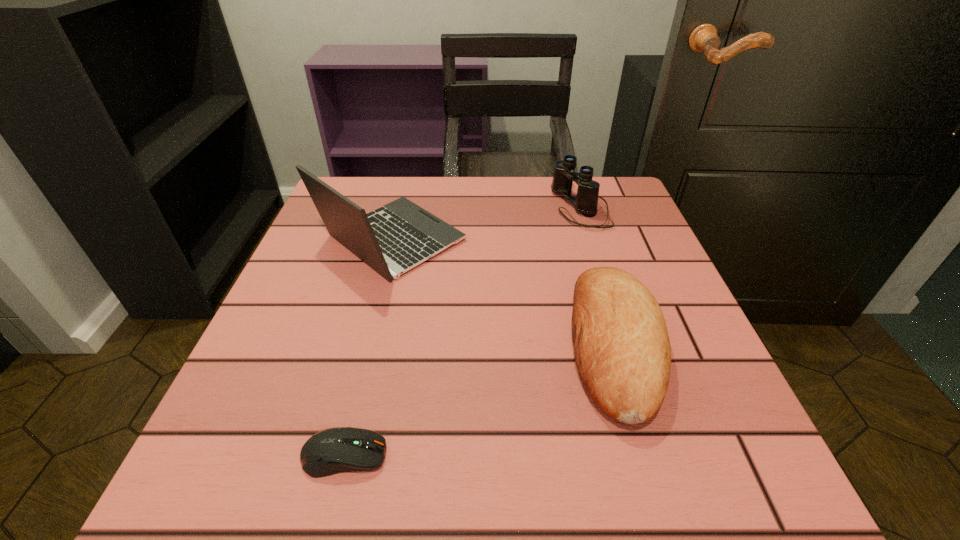
Find the location of a particular element. This screenshot has width=960, height=540. the second closest object to the binoculars is located at coordinates coord(393,239).

Where is `object that stands as the closest to the shortest object`? object that stands as the closest to the shortest object is located at coordinates (622, 350).

Where is `free space that satisfies the following two spatial constraints: 1. at the front screen of the tallest object; 2. on the left side of the bread`? This screenshot has width=960, height=540. free space that satisfies the following two spatial constraints: 1. at the front screen of the tallest object; 2. on the left side of the bread is located at coordinates (365, 346).

Identify the location of vacant region that satisfies the following two spatial constraints: 1. on the back side of the binoculars; 2. on the right side of the third tallest object. The height and width of the screenshot is (540, 960). (574, 207).

Identify the location of vacant area in the image that satisfies the following two spatial constraints: 1. at the front screen of the laptop_computer; 2. on the right side of the third tallest object. (365, 346).

At what (x,y) coordinates should I click in order to perform the action: click on blank area in the image that satisfies the following two spatial constraints: 1. on the front side of the third tallest object; 2. on the button of the shortest object. Please return your answer as a coordinate pair (x, y). Looking at the image, I should click on (649, 455).

At what (x,y) coordinates should I click in order to perform the action: click on free space in the image that satisfies the following two spatial constraints: 1. at the front screen of the bread; 2. on the left side of the tallest object. Please return your answer as a coordinate pair (x, y). Image resolution: width=960 pixels, height=540 pixels. Looking at the image, I should click on (365, 346).